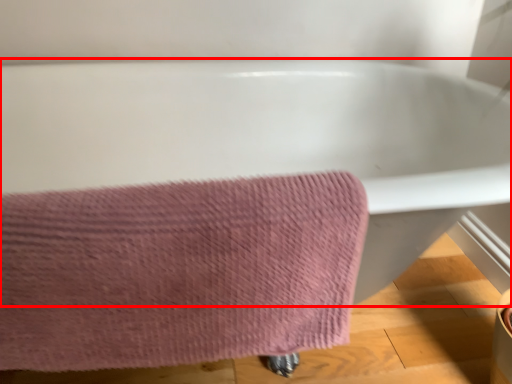
Question: Observing the image, what is the correct spatial positioning of bathtub (annotated by the red box) in reference to towel?

Choices:
 (A) right
 (B) left

Answer: (A)